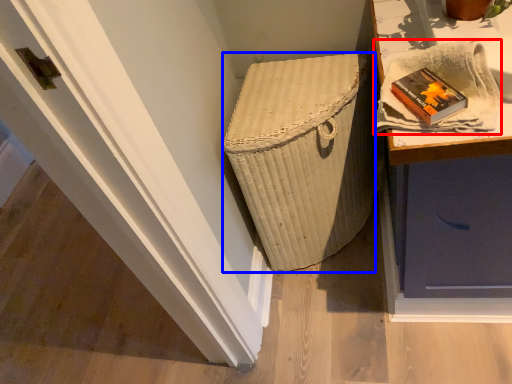
Question: Which object appears farthest to the camera in this image, cloth (highlighted by a red box) or basket container (highlighted by a blue box)?

Choices:
 (A) cloth
 (B) basket container

Answer: (B)